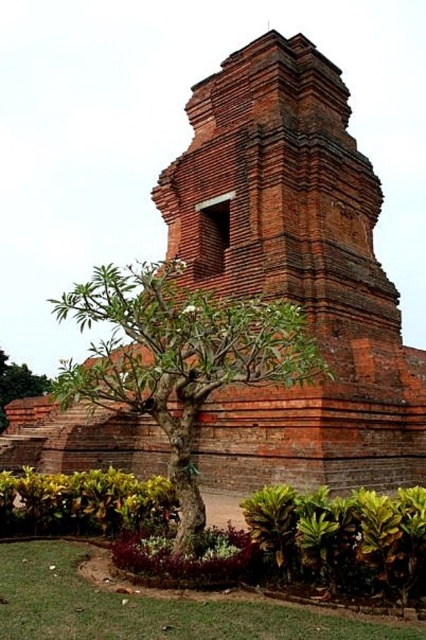
Does green leafy shrub at lower right appear on the left side of green leafy tree at lower left?

In fact, green leafy shrub at lower right is to the right of green leafy tree at lower left.

Can you confirm if green leafy shrub at lower right is positioned to the right of green leafy tree at lower left?

Correct, you'll find green leafy shrub at lower right to the right of green leafy tree at lower left.

What do you see at coordinates (344, 538) in the screenshot? Image resolution: width=426 pixels, height=640 pixels. I see `green leafy shrub at lower right` at bounding box center [344, 538].

Find the location of a particular element. This screenshot has height=640, width=426. green leafy shrub at lower right is located at coordinates (344, 538).

Looking at this image, does green leafy shrub at lower right appear over green leafy shrub at lower left?

Yes, green leafy shrub at lower right is above green leafy shrub at lower left.

Between point (416, 512) and point (43, 484), which one is positioned behind?

Positioned behind is point (43, 484).

The image size is (426, 640). What are the coordinates of `green leafy shrub at lower right` in the screenshot? It's located at (344, 538).

Consider the image. Is green leafy shrub at lower left positioned in front of green leafy tree at lower left?

Yes, green leafy shrub at lower left is closer to the viewer.

Looking at this image, is green leafy shrub at lower left to the left of green leafy tree at lower left from the viewer's perspective?

No, green leafy shrub at lower left is not to the left of green leafy tree at lower left.

Does point (138, 502) come farther from viewer compared to point (22, 368)?

No, (138, 502) is closer to viewer.

This screenshot has height=640, width=426. In order to click on green leafy shrub at lower left in this screenshot , I will do `click(83, 502)`.